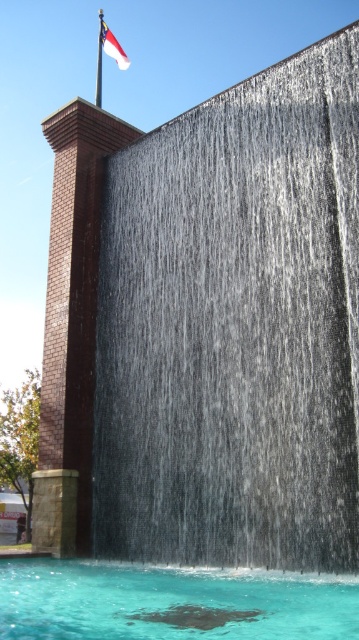
Can you confirm if white fabric flag at upper left is positioned below metallic flag pole at upper left?

No.

Is white fabric flag at upper left to the right of metallic flag pole at upper left from the viewer's perspective?

Correct, you'll find white fabric flag at upper left to the right of metallic flag pole at upper left.

The height and width of the screenshot is (640, 359). What are the coordinates of `white fabric flag at upper left` in the screenshot? It's located at (112, 45).

How distant is silver metallic waterfall at upper center from clear water at center?

The distance of silver metallic waterfall at upper center from clear water at center is 8.27 meters.

Is silver metallic waterfall at upper center above clear water at center?

Yes.

Is point (240, 230) behind point (80, 611)?

Yes, it is behind point (80, 611).

Find the location of a particular element. Image resolution: width=359 pixels, height=640 pixels. silver metallic waterfall at upper center is located at coordinates (235, 326).

Between point (201, 538) and point (96, 84), which one is positioned in front?

Point (201, 538)

Which is more to the right, silver metallic waterfall at upper center or metallic flag pole at upper left?

silver metallic waterfall at upper center

At what (x,y) coordinates should I click in order to perform the action: click on silver metallic waterfall at upper center. Please return your answer as a coordinate pair (x, y). The height and width of the screenshot is (640, 359). Looking at the image, I should click on (235, 326).